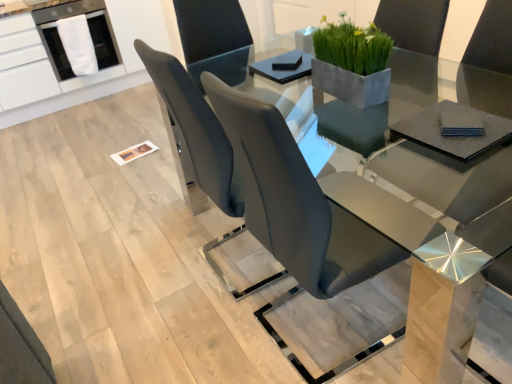
Where is `blank space situated above white fabric at upper left (from a real-world perspective)`? The width and height of the screenshot is (512, 384). blank space situated above white fabric at upper left (from a real-world perspective) is located at coordinates (64, 11).